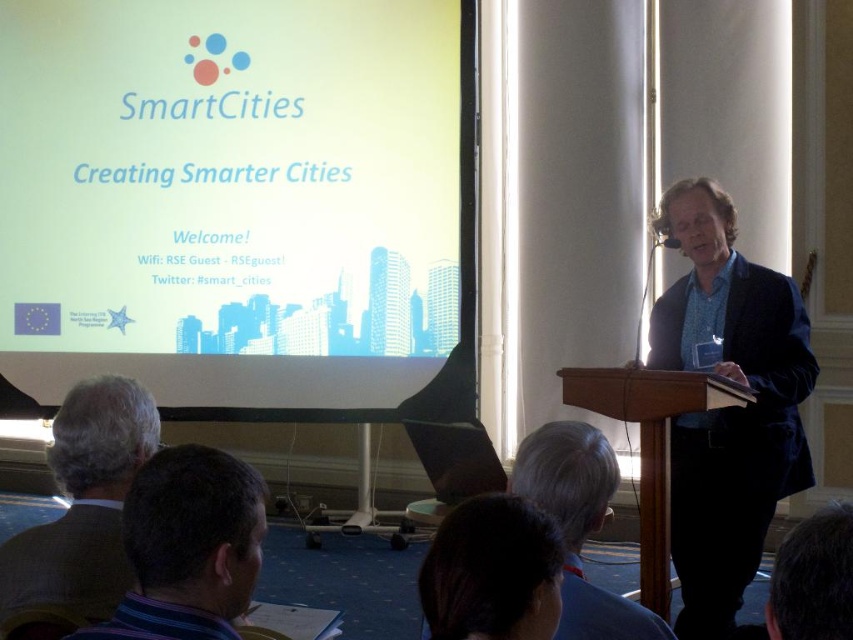
Which of these two, white matte projection screen at upper center or dark blue striped shirt at lower left, stands taller?

white matte projection screen at upper center is taller.

Does white matte projection screen at upper center have a smaller size compared to dark blue striped shirt at lower left?

No.

Where is `white matte projection screen at upper center`? white matte projection screen at upper center is located at coordinates (241, 205).

Does gray hair at upper center appear under wooden podium at center?

No.

I want to click on gray hair at upper center, so click(x=579, y=524).

Locate an element on the screen. Image resolution: width=853 pixels, height=640 pixels. gray hair at upper center is located at coordinates (579, 524).

Does dark blue striped shirt at lower left appear under gray wool sweater at lower left?

No.

Is the position of dark blue striped shirt at lower left more distant than that of gray wool sweater at lower left?

That is False.

Is point (138, 486) positioned before point (97, 593)?

Yes, point (138, 486) is closer to viewer.

Locate an element on the screen. This screenshot has width=853, height=640. dark blue striped shirt at lower left is located at coordinates [189, 547].